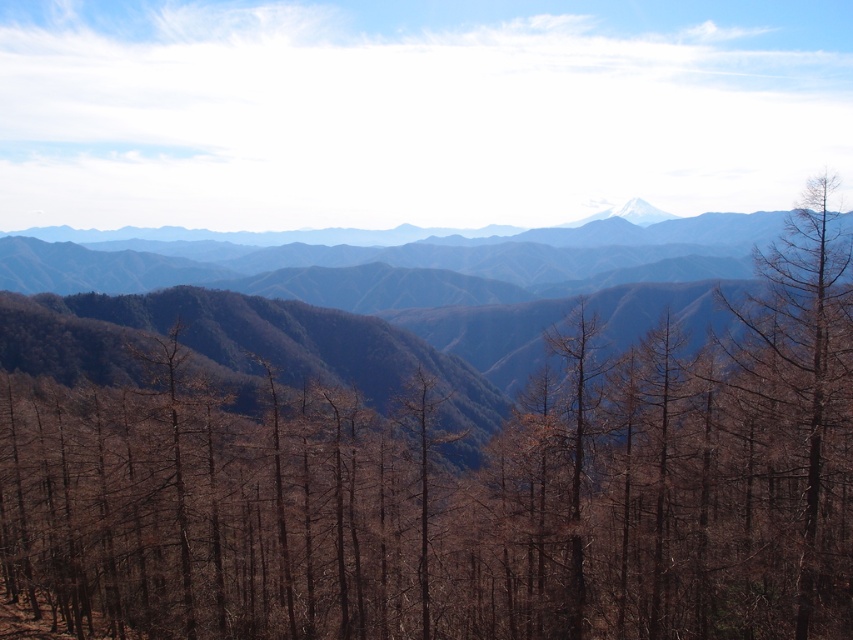
Does brown matte tree at center have a lesser height compared to white snow-capped peak at center?

Yes, brown matte tree at center is shorter than white snow-capped peak at center.

Which is behind, point (335, 540) or point (584, 221)?

The point (584, 221) is more distant.

The width and height of the screenshot is (853, 640). What are the coordinates of `brown matte tree at center` in the screenshot? It's located at (463, 492).

Between brown matte tree at center and brown textured mountain range at center, which one appears on the right side from the viewer's perspective?

brown textured mountain range at center is more to the right.

Can you confirm if brown matte tree at center is positioned above brown textured mountain range at center?

No.

Between point (384, 636) and point (386, 253), which one is positioned in front?

Point (384, 636) is more forward.

At what (x,y) coordinates should I click in order to perform the action: click on brown matte tree at center. Please return your answer as a coordinate pair (x, y). Image resolution: width=853 pixels, height=640 pixels. Looking at the image, I should click on (463, 492).

Is brown matte tree at right smaller than white snow-capped peak at center?

Yes.

Which is more to the right, brown matte tree at right or white snow-capped peak at center?

white snow-capped peak at center is more to the right.

Where is `brown matte tree at right`? The height and width of the screenshot is (640, 853). brown matte tree at right is located at coordinates (804, 403).

Where is `brown matte tree at right`? brown matte tree at right is located at coordinates (804, 403).